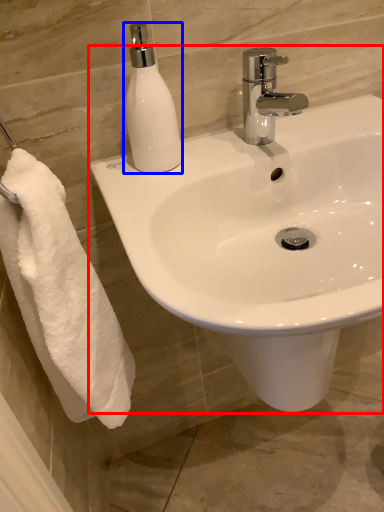
Question: Which object appears closest to the camera in this image, sink (highlighted by a red box) or soap dispenser (highlighted by a blue box)?

Choices:
 (A) sink
 (B) soap dispenser

Answer: (A)